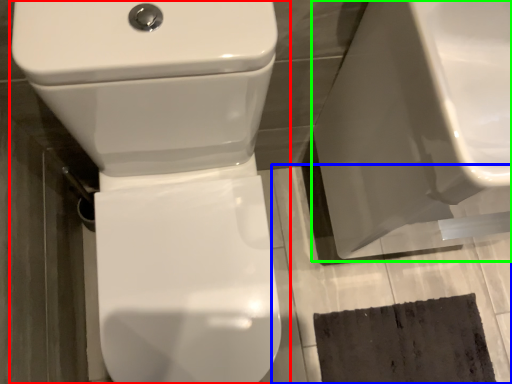
Question: Based on their relative distances, which object is nearer to toilet (highlighted by a red box)? Choose from concrete (highlighted by a blue box) and porcelain (highlighted by a green box).

Choices:
 (A) concrete
 (B) porcelain

Answer: (B)